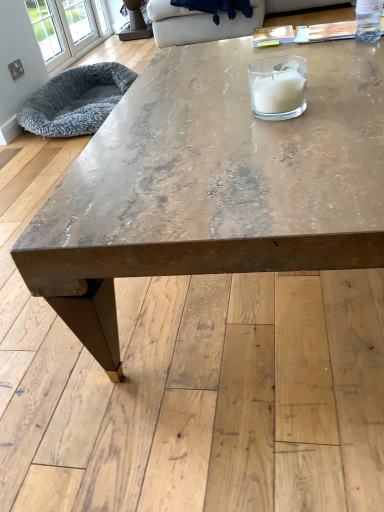
Question: From a real-world perspective, is distressed wood coffee table at center positioned over clear glass bottle at upper right based on gravity?

Choices:
 (A) no
 (B) yes

Answer: (A)

Question: Does distressed wood coffee table at center have a greater height compared to clear glass bottle at upper right?

Choices:
 (A) yes
 (B) no

Answer: (A)

Question: Can you confirm if distressed wood coffee table at center is wider than clear glass bottle at upper right?

Choices:
 (A) yes
 (B) no

Answer: (A)

Question: Is distressed wood coffee table at center shorter than clear glass bottle at upper right?

Choices:
 (A) yes
 (B) no

Answer: (B)

Question: From the image's perspective, is distressed wood coffee table at center under clear glass bottle at upper right?

Choices:
 (A) no
 (B) yes

Answer: (B)

Question: From a real-world perspective, is distressed wood coffee table at center below clear glass bottle at upper right?

Choices:
 (A) no
 (B) yes

Answer: (B)

Question: From a real-world perspective, is white glass candle at upper center physically below clear glass bottle at upper right?

Choices:
 (A) yes
 (B) no

Answer: (A)

Question: Considering the relative sizes of white glass candle at upper center and clear glass bottle at upper right in the image provided, is white glass candle at upper center smaller than clear glass bottle at upper right?

Choices:
 (A) no
 (B) yes

Answer: (A)

Question: Would you consider white glass candle at upper center to be distant from clear glass bottle at upper right?

Choices:
 (A) yes
 (B) no

Answer: (B)

Question: Is white glass candle at upper center touching clear glass bottle at upper right?

Choices:
 (A) no
 (B) yes

Answer: (A)

Question: From the image's perspective, is white glass candle at upper center under clear glass bottle at upper right?

Choices:
 (A) no
 (B) yes

Answer: (B)

Question: Could you tell me if white glass candle at upper center is facing clear glass bottle at upper right?

Choices:
 (A) no
 (B) yes

Answer: (A)

Question: Is beige fabric couch at upper center taller than white glass candle at upper center?

Choices:
 (A) no
 (B) yes

Answer: (B)